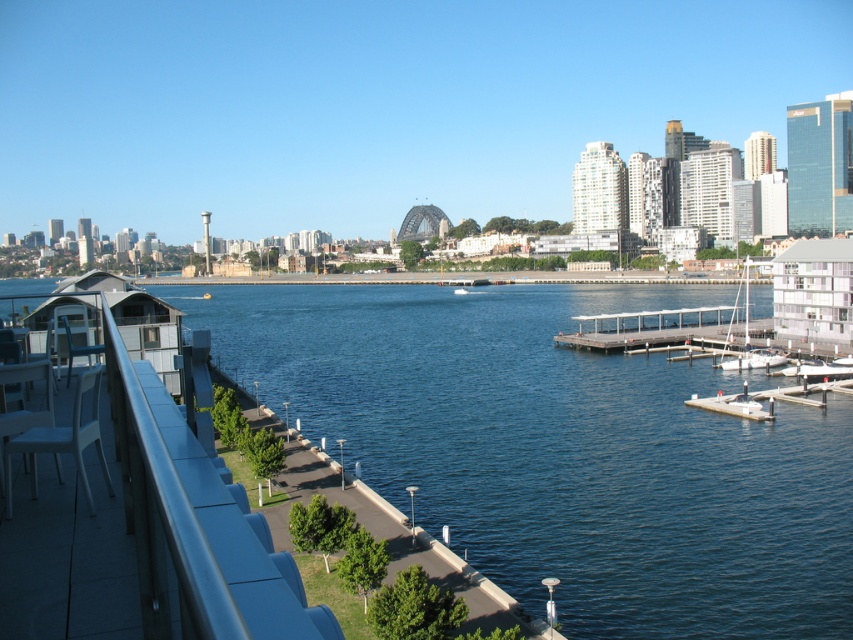
Question: Which point is closer to the camera?

Choices:
 (A) (328, 396)
 (B) (697, 326)

Answer: (A)

Question: Does blue water at center appear under white matte sailboat at right?

Choices:
 (A) yes
 (B) no

Answer: (A)

Question: Which of the following is the farthest from the observer?

Choices:
 (A) (556, 403)
 (B) (633, 317)

Answer: (B)

Question: Estimate the real-world distances between objects in this image. Which object is closer to the blue water at center?

Choices:
 (A) white matte sailboat at right
 (B) light gray wooden dock at center

Answer: (B)

Question: Can you confirm if light gray wooden dock at center is positioned above white matte sailboat at right?

Choices:
 (A) yes
 (B) no

Answer: (B)

Question: Can you confirm if light gray wooden dock at center is thinner than white matte sailboat at right?

Choices:
 (A) no
 (B) yes

Answer: (B)